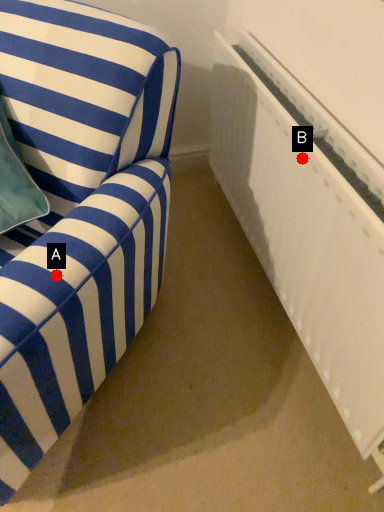
Question: Two points are circled on the image, labeled by A and B beside each circle. Among these points, which one is nearest to the camera?

Choices:
 (A) A is closer
 (B) B is closer

Answer: (A)